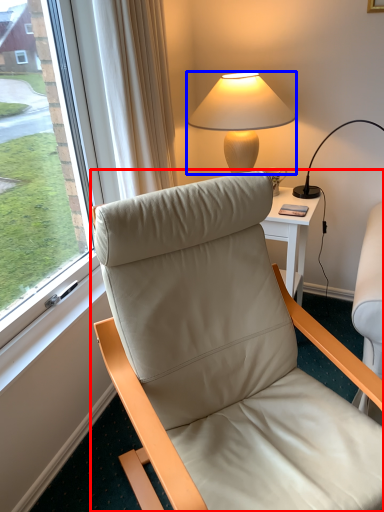
Question: Which object is further to the camera taking this photo, chair (highlighted by a red box) or lamp (highlighted by a blue box)?

Choices:
 (A) chair
 (B) lamp

Answer: (B)